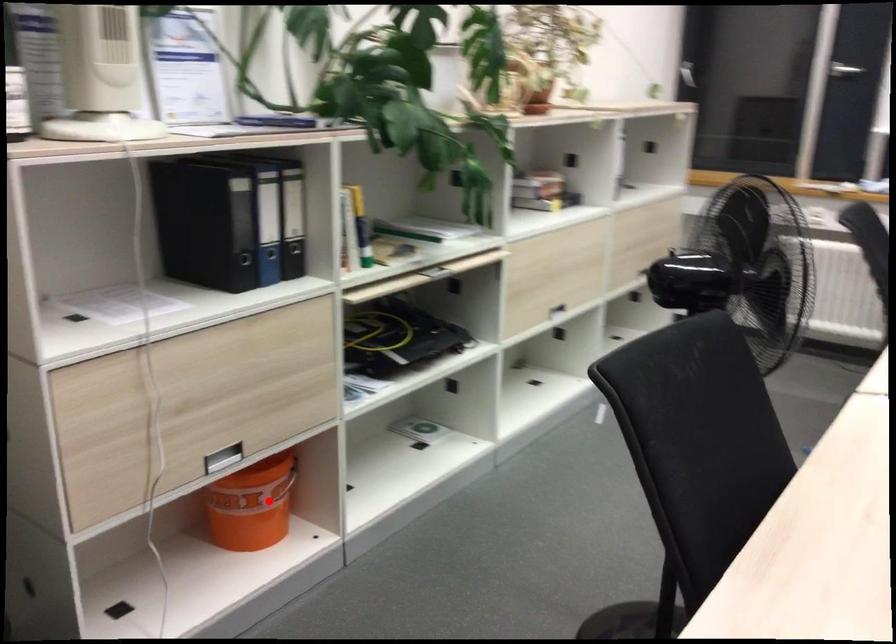
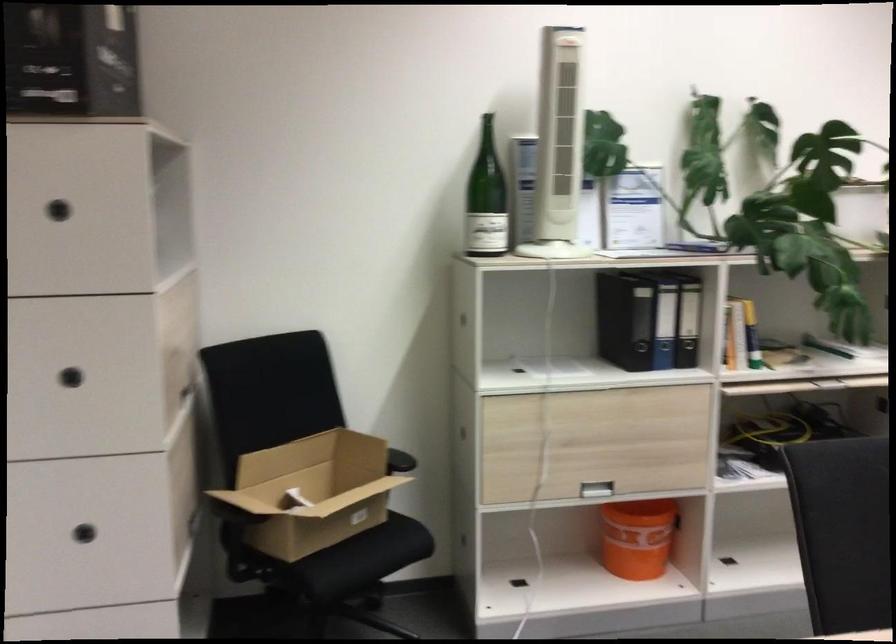
In the second image, find the point that corresponds to the highlighted location in the first image.

(636, 538)